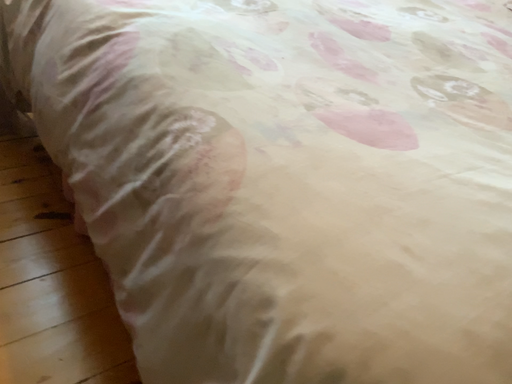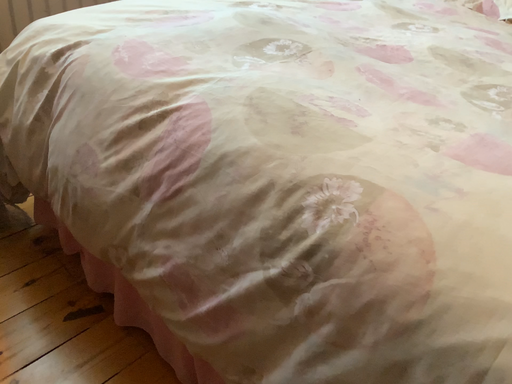
Question: How did the camera likely rotate when shooting the video?

Choices:
 (A) rotated right
 (B) rotated left

Answer: (A)